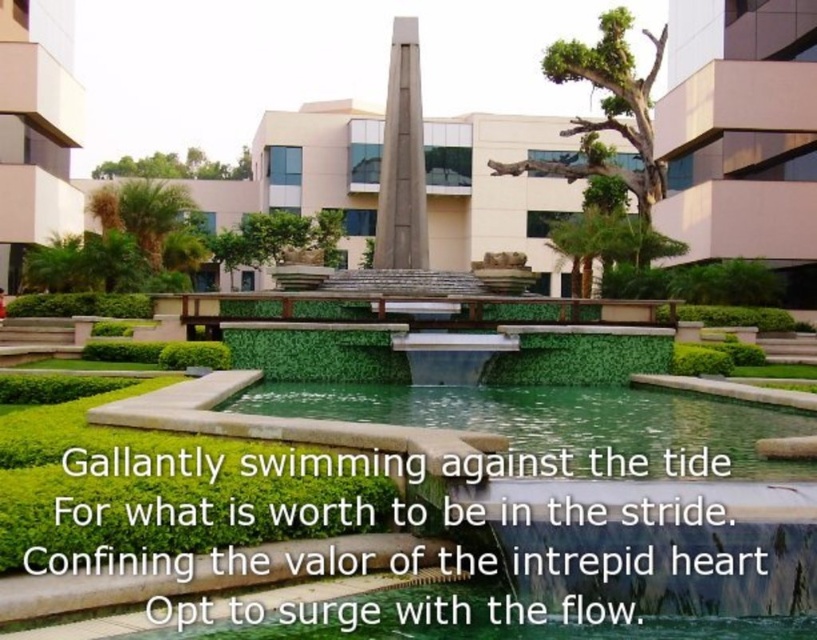
Which is more to the right, green smooth water at center or slate gray stone obelisk at center?

green smooth water at center is more to the right.

Is point (730, 474) positioned in front of point (413, 220)?

Yes, it is in front of point (413, 220).

Find the location of a particular element. green smooth water at center is located at coordinates (565, 422).